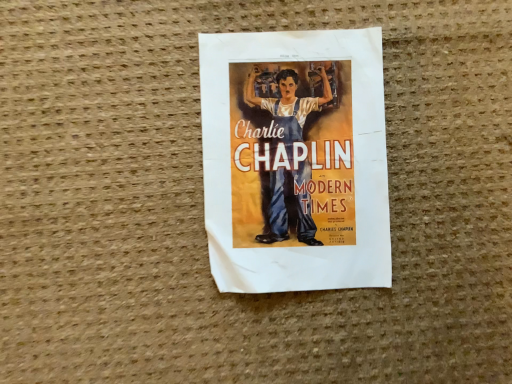
The height and width of the screenshot is (384, 512). Describe the element at coordinates (295, 160) in the screenshot. I see `matte paper poster at center` at that location.

What is the approximate height of matte paper poster at center?

It is 0.67 inches.

Where is `matte paper poster at center`? matte paper poster at center is located at coordinates click(295, 160).

This screenshot has height=384, width=512. In order to click on matte paper poster at center in this screenshot , I will do `click(295, 160)`.